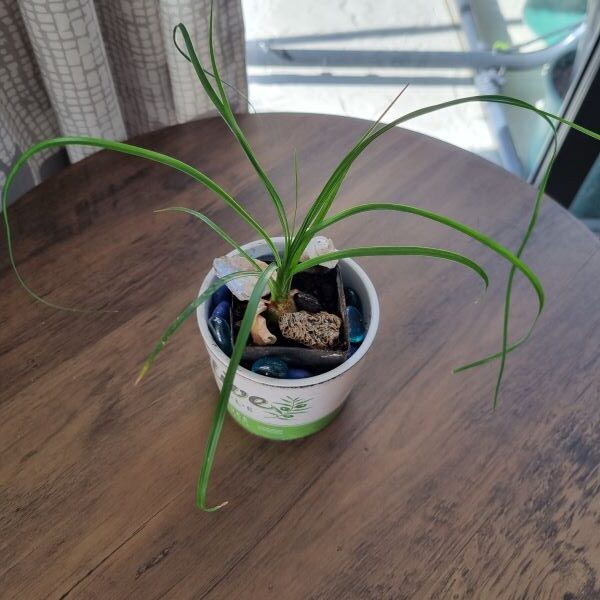
This screenshot has height=600, width=600. Find the location of `empty table top in the lower right corner`. empty table top in the lower right corner is located at coordinates (511, 516).